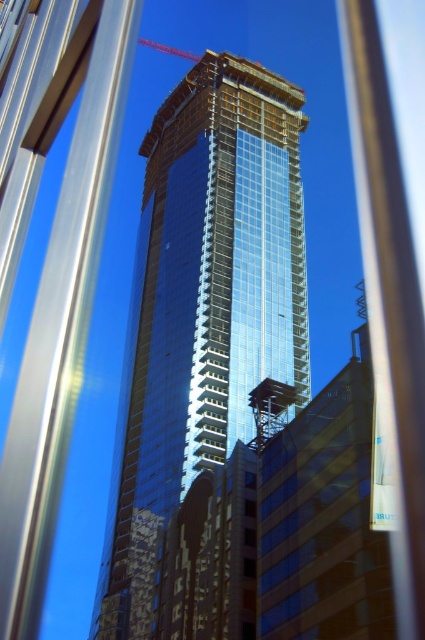
Does shiny glass tower at center have a lesser width compared to metallic red crane at upper center?

No.

Does shiny glass tower at center have a larger size compared to metallic red crane at upper center?

Yes.

Which is behind, point (297, 131) or point (178, 54)?

Point (178, 54)

You are a GUI agent. You are given a task and a screenshot of the screen. Output one action in this format:
    pyautogui.click(x=<x>, y=<y>)
    Task: Click on the shiny glass tower at center
    
    Given the screenshot: What is the action you would take?
    pyautogui.click(x=203, y=308)